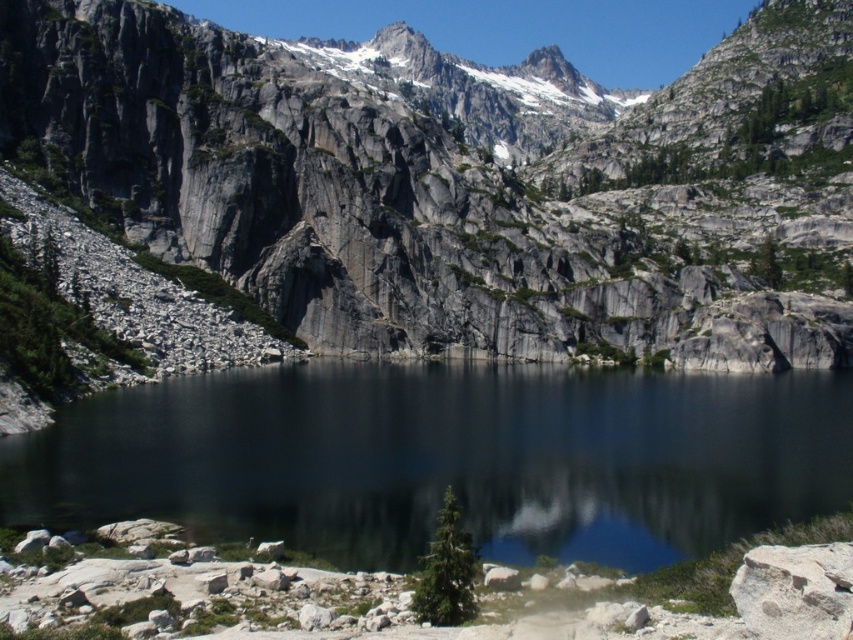
Question: Which point is farther to the camera?

Choices:
 (A) gray rock mountain at center
 (B) smooth dark water at center

Answer: (A)

Question: Does gray rock mountain at center have a larger size compared to smooth dark water at center?

Choices:
 (A) yes
 (B) no

Answer: (A)

Question: Which point is closer to the camera taking this photo?

Choices:
 (A) (361, 499)
 (B) (804, 12)

Answer: (A)

Question: Is gray rock mountain at center bigger than smooth dark water at center?

Choices:
 (A) no
 (B) yes

Answer: (B)

Question: Does gray rock mountain at center have a larger size compared to smooth dark water at center?

Choices:
 (A) no
 (B) yes

Answer: (B)